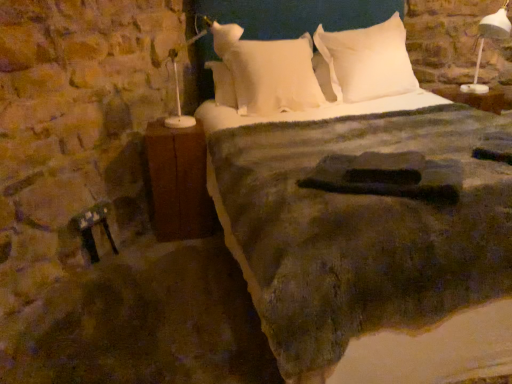
Question: Does white soft pillow at upper center, which is the 1th pillow in right-to-left order, have a lesser height compared to brown wood nightstand at left?

Choices:
 (A) no
 (B) yes

Answer: (B)

Question: Considering the relative positions of white soft pillow at upper center, which is the 1th pillow in right-to-left order, and brown wood nightstand at left in the image provided, is white soft pillow at upper center, which is the 1th pillow in right-to-left order, in front of brown wood nightstand at left?

Choices:
 (A) yes
 (B) no

Answer: (B)

Question: Considering the relative sizes of white soft pillow at upper center, which is the 1th pillow in right-to-left order, and brown wood nightstand at left in the image provided, is white soft pillow at upper center, which is the 1th pillow in right-to-left order, thinner than brown wood nightstand at left?

Choices:
 (A) yes
 (B) no

Answer: (B)

Question: From a real-world perspective, is white soft pillow at upper center, which is the 1th pillow in right-to-left order, on top of brown wood nightstand at left?

Choices:
 (A) no
 (B) yes

Answer: (B)

Question: Is white soft pillow at upper center, which is the 1th pillow in right-to-left order, smaller than brown wood nightstand at left?

Choices:
 (A) yes
 (B) no

Answer: (B)

Question: Is brown wood nightstand at left to the left or to the right of white soft pillow at upper center, which is the 1th pillow in right-to-left order, in the image?

Choices:
 (A) left
 (B) right

Answer: (A)

Question: Does point (164, 231) appear closer or farther from the camera than point (331, 67)?

Choices:
 (A) farther
 (B) closer

Answer: (B)

Question: In terms of size, does brown wood nightstand at left appear bigger or smaller than white soft pillow at upper center, the second pillow when ordered from left to right?

Choices:
 (A) big
 (B) small

Answer: (B)

Question: Considering their positions, is brown wood nightstand at left located in front of or behind white soft pillow at upper center, the second pillow when ordered from left to right?

Choices:
 (A) front
 (B) behind

Answer: (A)

Question: In terms of size, does white soft pillow at center, the 2th pillow positioned from the right, appear bigger or smaller than white soft pillow at upper center, which is the 1th pillow in right-to-left order?

Choices:
 (A) small
 (B) big

Answer: (B)

Question: Is white soft pillow at center, the 2th pillow positioned from the right, wider or thinner than white soft pillow at upper center, the second pillow when ordered from left to right?

Choices:
 (A) thin
 (B) wide

Answer: (B)

Question: From the image's perspective, is white soft pillow at center, which is the 1th pillow in left-to-right order, positioned above or below white soft pillow at upper center, the second pillow when ordered from left to right?

Choices:
 (A) below
 (B) above

Answer: (A)

Question: Is white soft pillow at center, the 2th pillow positioned from the right, spatially inside white soft pillow at upper center, the second pillow when ordered from left to right, or outside of it?

Choices:
 (A) outside
 (B) inside

Answer: (A)

Question: Which is correct: white soft pillow at upper center, the second pillow when ordered from left to right, is inside white soft pillow at center, which is the 1th pillow in left-to-right order, or outside of it?

Choices:
 (A) outside
 (B) inside

Answer: (A)

Question: Considering the relative positions of white soft pillow at upper center, the second pillow when ordered from left to right, and white soft pillow at center, the 2th pillow positioned from the right, in the image provided, is white soft pillow at upper center, the second pillow when ordered from left to right, to the left or to the right of white soft pillow at center, the 2th pillow positioned from the right,?

Choices:
 (A) left
 (B) right

Answer: (B)